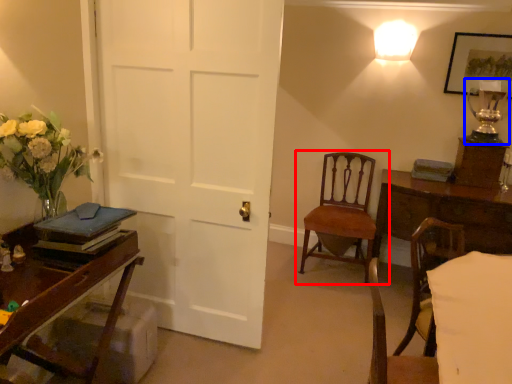
Question: Which of the following is the farthest to the observer, chair (highlighted by a red box) or table lamp (highlighted by a blue box)?

Choices:
 (A) chair
 (B) table lamp

Answer: (A)